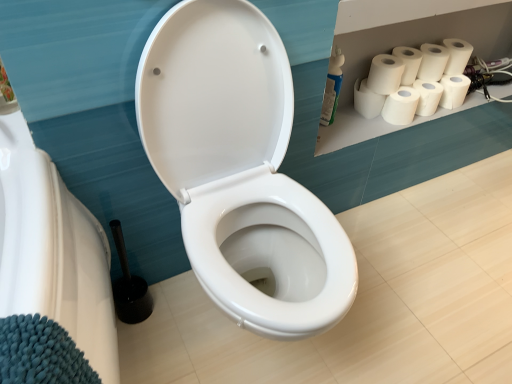
Find the location of `free point in front of white matte paper towel at upper right, acting as the first paper towel starting from the left`. free point in front of white matte paper towel at upper right, acting as the first paper towel starting from the left is located at coordinates (359, 127).